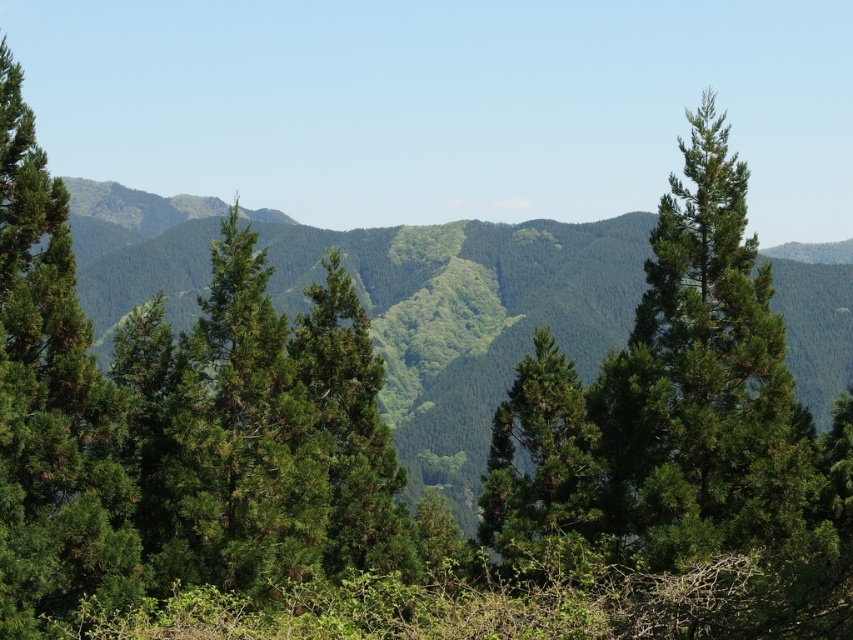
You are standing in the mountain landscape and want to take a photo of the green matte tree at left. If you are currently 25.76 meters away from it, is the tree in focus or out of focus?

The green matte tree at left is out of focus because the description states that the coniferous trees in the foreground are slightly out of focus, and the distance between you and the tree is exactly 25.76 meters as given.

You are standing in the mountain landscape and notice two trees at the center of the scene. Which tree is positioned to the left when looking at the green textured tree at center and the green matte tree at center?

The green textured tree at center is positioned to the left of the green matte tree at center.

You are a hiker planning to set up a tent between the green matte tree at left and the green matte tree at center. Which tree should you choose as the reference point if you want to set up your tent closer to the smaller tree?

You should choose the green matte tree at left as the reference point because it is the smaller tree between the two.